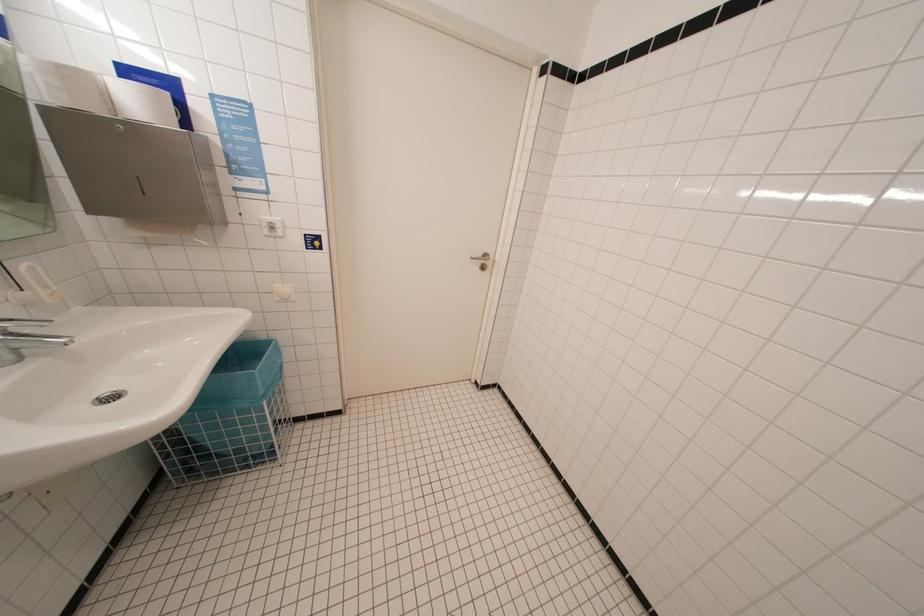
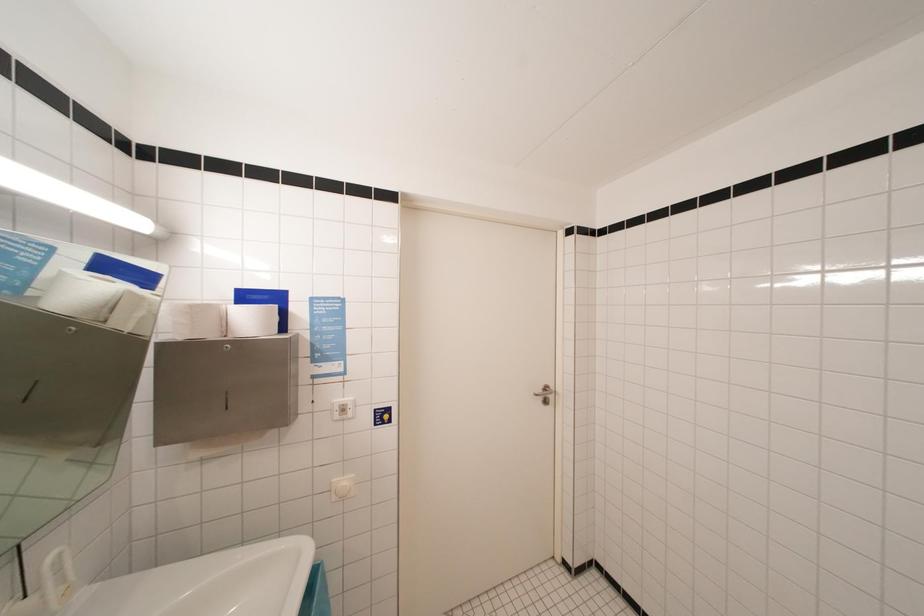
Question: The first image is from the beginning of the video and the second image is from the end. How did the camera likely rotate when shooting the video?

Choices:
 (A) Left
 (B) Right
 (C) Up
 (D) Down

Answer: (C)